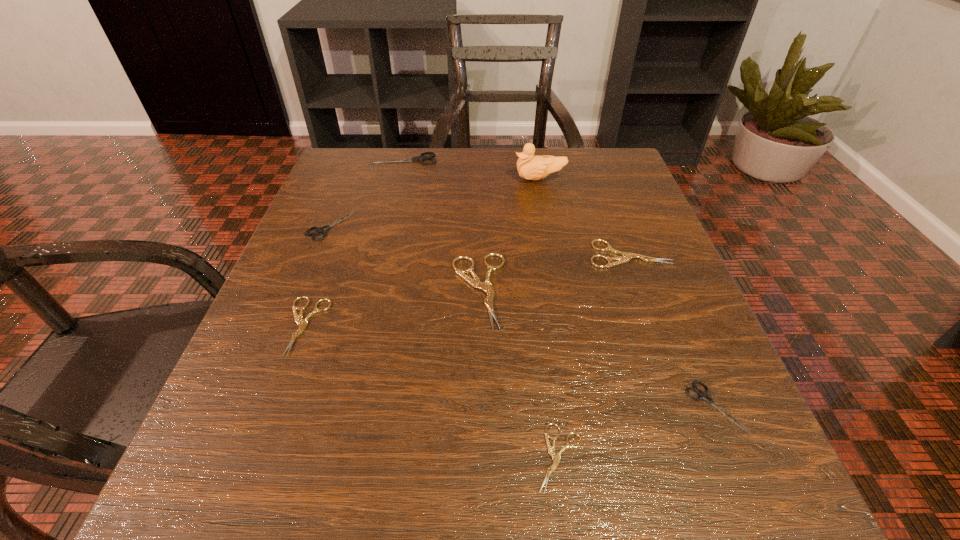
The image size is (960, 540). Find the location of `the rightmost black shears`. the rightmost black shears is located at coordinates (702, 395).

Where is `the smallest beige shears`? the smallest beige shears is located at coordinates [556, 457].

The width and height of the screenshot is (960, 540). What are the coordinates of `the third beige shears from left to right` in the screenshot? It's located at (556, 457).

The height and width of the screenshot is (540, 960). Find the location of `vacant space situated 0.050m on the face of the second farthest object`. vacant space situated 0.050m on the face of the second farthest object is located at coordinates (492, 179).

Locate an element on the screen. Image resolution: width=960 pixels, height=540 pixels. vacant space located on the face of the second farthest object is located at coordinates (467, 179).

This screenshot has height=540, width=960. I want to click on vacant space positioned 0.090m on the face of the second farthest object, so click(x=475, y=179).

Image resolution: width=960 pixels, height=540 pixels. Find the location of `vacant position located 0.070m on the left of the farthest object`. vacant position located 0.070m on the left of the farthest object is located at coordinates coord(344,160).

You are a GUI agent. You are given a task and a screenshot of the screen. Output one action in this format:
    pyautogui.click(x=<x>, y=<y>)
    Task: Click on the free location located 0.280m on the right of the fourth shears from right to left
    
    Given the screenshot: What is the action you would take?
    pyautogui.click(x=669, y=290)

Where is `free space located 0.340m on the right of the second biggest black shears`? Image resolution: width=960 pixels, height=540 pixels. free space located 0.340m on the right of the second biggest black shears is located at coordinates (523, 225).

Where is `vacant space located on the front of the rightmost beige shears`? The width and height of the screenshot is (960, 540). vacant space located on the front of the rightmost beige shears is located at coordinates (700, 446).